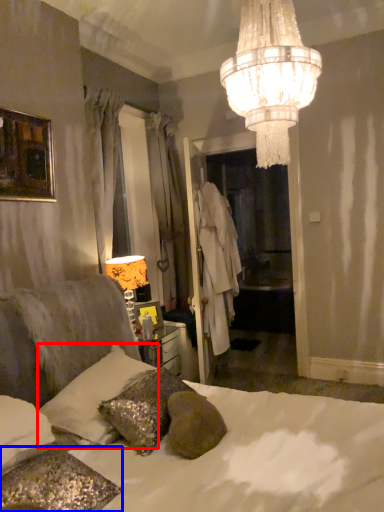
Question: Which point is closer to the camera, pillow (highlighted by a red box) or pillow (highlighted by a blue box)?

Choices:
 (A) pillow
 (B) pillow

Answer: (B)